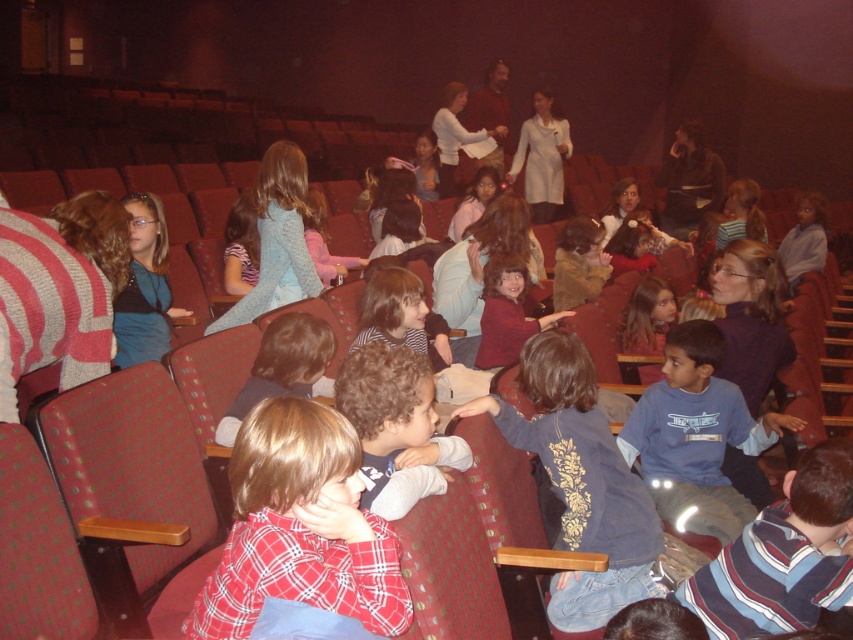
Looking at this image, between matte blue sweater at center and matte black jacket at center, which one has less height?

matte blue sweater at center

Can you confirm if matte blue sweater at center is shorter than matte black jacket at center?

Yes.

You are a GUI agent. You are given a task and a screenshot of the screen. Output one action in this format:
    pyautogui.click(x=<x>, y=<y>)
    Task: Click on the matte blue sweater at center
    
    Given the screenshot: What is the action you would take?
    pyautogui.click(x=144, y=285)

Between striped cotton shirt at lower right and matte brown jacket at center, which one is positioned lower?

striped cotton shirt at lower right

Does striped cotton shirt at lower right appear over matte brown jacket at center?

Actually, striped cotton shirt at lower right is below matte brown jacket at center.

Locate an element on the screen. The width and height of the screenshot is (853, 640). striped cotton shirt at lower right is located at coordinates [x=782, y=556].

Describe the element at coordinates (277, 237) in the screenshot. I see `light blue knitted sweater at center` at that location.

Does light blue knitted sweater at center appear on the left side of brown fuzzy sweater at center?

Yes, light blue knitted sweater at center is to the left of brown fuzzy sweater at center.

Where is `light blue knitted sweater at center`? The width and height of the screenshot is (853, 640). light blue knitted sweater at center is located at coordinates (277, 237).

Find the location of `light blue knitted sweater at center`. light blue knitted sweater at center is located at coordinates (277, 237).